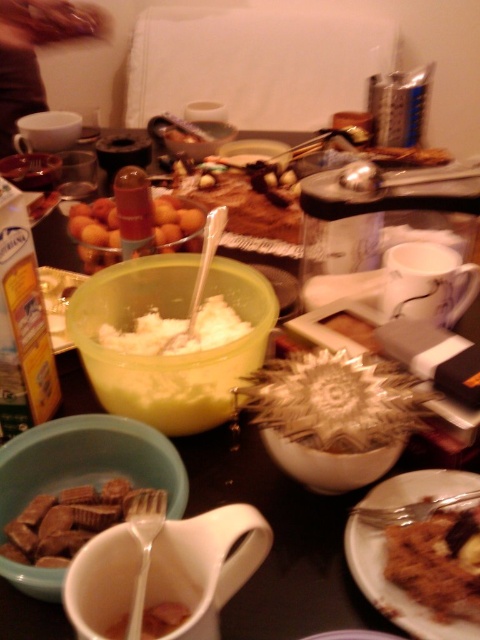
You are a guest at a dinner party and want to reach the brown crumbly cake at center. The host has placed it at point [436,563]. If you are standing at the edge of the table, which direction should you move to get to the cake?

The brown crumbly cake at center is located at point [436,563], so you should move towards the center of the table to reach it.